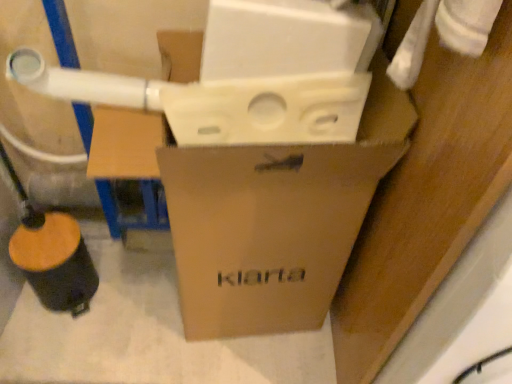
The width and height of the screenshot is (512, 384). I want to click on wooden/textured water pipe at lower left, so click(51, 254).

The image size is (512, 384). Describe the element at coordinates (51, 254) in the screenshot. I see `wooden/textured water pipe at lower left` at that location.

This screenshot has width=512, height=384. What do you see at coordinates (259, 211) in the screenshot? I see `brown cardboard box at center` at bounding box center [259, 211].

Locate an element on the screen. The width and height of the screenshot is (512, 384). brown cardboard box at center is located at coordinates (259, 211).

Where is `wooden/textured water pipe at lower left`? wooden/textured water pipe at lower left is located at coordinates (51, 254).

Considering the relative positions of wooden/textured water pipe at lower left and brown cardboard box at center in the image provided, is wooden/textured water pipe at lower left to the right of brown cardboard box at center from the viewer's perspective?

In fact, wooden/textured water pipe at lower left is to the left of brown cardboard box at center.

Is the depth of wooden/textured water pipe at lower left less than that of brown cardboard box at center?

No, it is behind brown cardboard box at center.

Is point (22, 218) closer to viewer compared to point (149, 130)?

No, it is behind (149, 130).

From the image's perspective, is wooden/textured water pipe at lower left beneath brown cardboard box at center?

Yes, from the image's perspective, wooden/textured water pipe at lower left is beneath brown cardboard box at center.

From a real-world perspective, which is physically above, wooden/textured water pipe at lower left or brown cardboard box at center?

brown cardboard box at center.

Can you confirm if wooden/textured water pipe at lower left is wider than brown cardboard box at center?

No, wooden/textured water pipe at lower left is not wider than brown cardboard box at center.

Considering the relative sizes of wooden/textured water pipe at lower left and brown cardboard box at center in the image provided, is wooden/textured water pipe at lower left shorter than brown cardboard box at center?

Yes, wooden/textured water pipe at lower left is shorter than brown cardboard box at center.

Does wooden/textured water pipe at lower left have a smaller size compared to brown cardboard box at center?

Correct, wooden/textured water pipe at lower left occupies less space than brown cardboard box at center.

Is wooden/textured water pipe at lower left located outside brown cardboard box at center?

Yes.

Is wooden/textured water pipe at lower left directly adjacent to brown cardboard box at center?

They are not placed beside each other.

Is wooden/textured water pipe at lower left facing away from brown cardboard box at center?

wooden/textured water pipe at lower left does not have its back to brown cardboard box at center.

Can you tell me how much wooden/textured water pipe at lower left and brown cardboard box at center differ in facing direction?

The angular difference between wooden/textured water pipe at lower left and brown cardboard box at center is 2.98 degrees.

Find the location of a particular element. Image resolution: width=512 pixels, height=384 pixels. box on the right of the wooden/textured water pipe at lower left is located at coordinates (259, 211).

Can you confirm if brown cardboard box at center is positioned to the left of wooden/textured water pipe at lower left?

In fact, brown cardboard box at center is to the right of wooden/textured water pipe at lower left.

Based on the photo, relative to wooden/textured water pipe at lower left, is brown cardboard box at center in front or behind?

brown cardboard box at center is positioned closer to the viewer than wooden/textured water pipe at lower left.

Is point (358, 217) farther from camera compared to point (38, 239)?

No.

Based on the photo, from the image's perspective, is brown cardboard box at center under wooden/textured water pipe at lower left?

Incorrect, from the image's perspective, brown cardboard box at center is higher than wooden/textured water pipe at lower left.

From a real-world perspective, does brown cardboard box at center stand above wooden/textured water pipe at lower left?

Correct, in the physical world, brown cardboard box at center is higher than wooden/textured water pipe at lower left.

Considering the sizes of objects brown cardboard box at center and wooden/textured water pipe at lower left in the image provided, who is wider, brown cardboard box at center or wooden/textured water pipe at lower left?

Wider between the two is brown cardboard box at center.

Considering the relative sizes of brown cardboard box at center and wooden/textured water pipe at lower left in the image provided, is brown cardboard box at center shorter than wooden/textured water pipe at lower left?

No.

Considering the sizes of objects brown cardboard box at center and wooden/textured water pipe at lower left in the image provided, who is bigger, brown cardboard box at center or wooden/textured water pipe at lower left?

With larger size is brown cardboard box at center.

Would you say brown cardboard box at center contains wooden/textured water pipe at lower left?

That's incorrect, wooden/textured water pipe at lower left is not inside brown cardboard box at center.

Is brown cardboard box at center next to wooden/textured water pipe at lower left?

No, brown cardboard box at center is not touching wooden/textured water pipe at lower left.

Consider the image. Is brown cardboard box at center facing away from wooden/textured water pipe at lower left?

No, brown cardboard box at center is not facing away from wooden/textured water pipe at lower left.

Can you tell me how much brown cardboard box at center and wooden/textured water pipe at lower left differ in facing direction?

brown cardboard box at center and wooden/textured water pipe at lower left are facing 2.98 degrees away from each other.

This screenshot has width=512, height=384. What are the coordinates of `water pipe below the brown cardboard box at center (from the image's perspective)` in the screenshot? It's located at [x=51, y=254].

The height and width of the screenshot is (384, 512). Identify the location of water pipe below the brown cardboard box at center (from the image's perspective). 51,254.

Where is `water pipe that appears behind the brown cardboard box at center`? The image size is (512, 384). water pipe that appears behind the brown cardboard box at center is located at coordinates (51, 254).